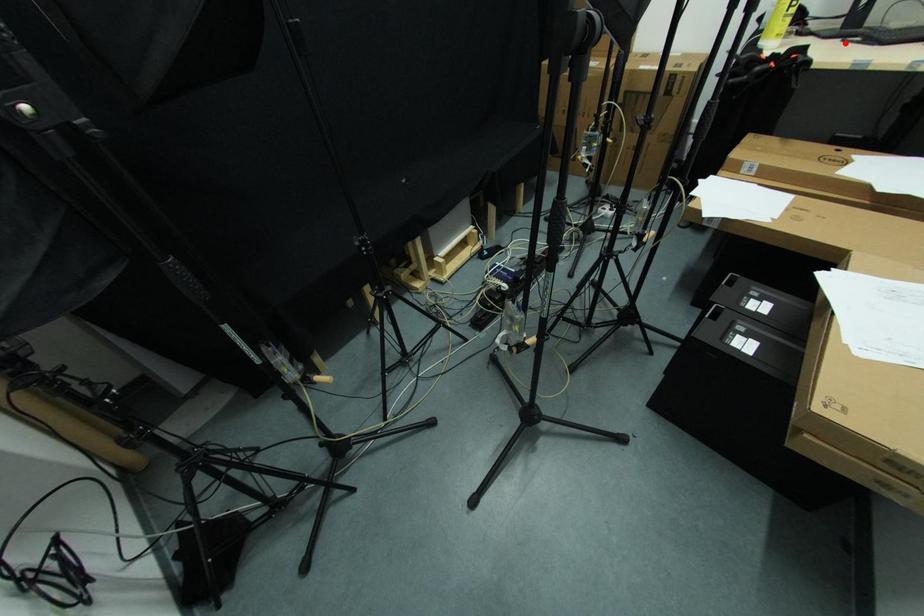
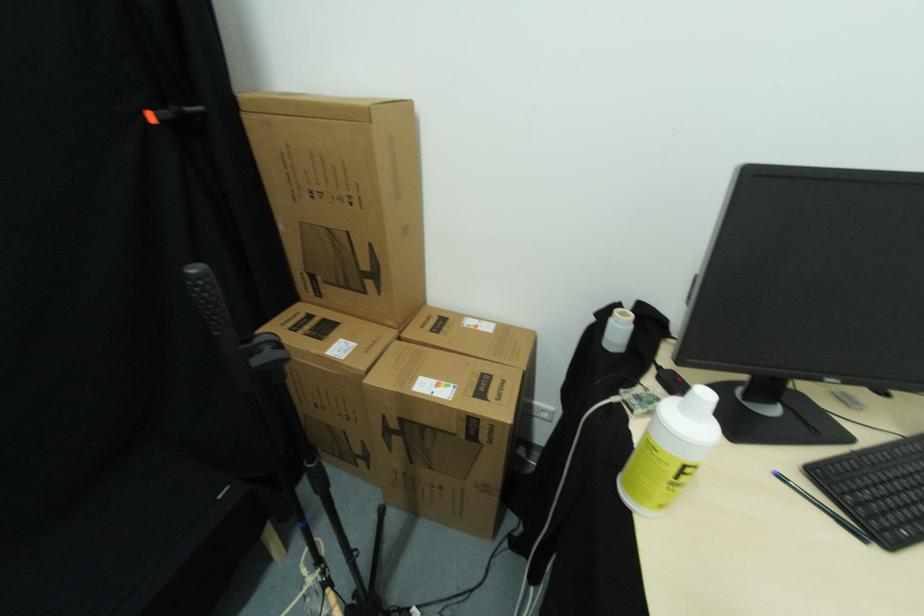
Question: I am providing you with two images of the same scene from different viewpoints. In image1, a red point is highlighted. Considering the same 3D point in image2, which of the following is correct?

Choices:
 (A) It is closer
 (B) It is farther

Answer: (A)